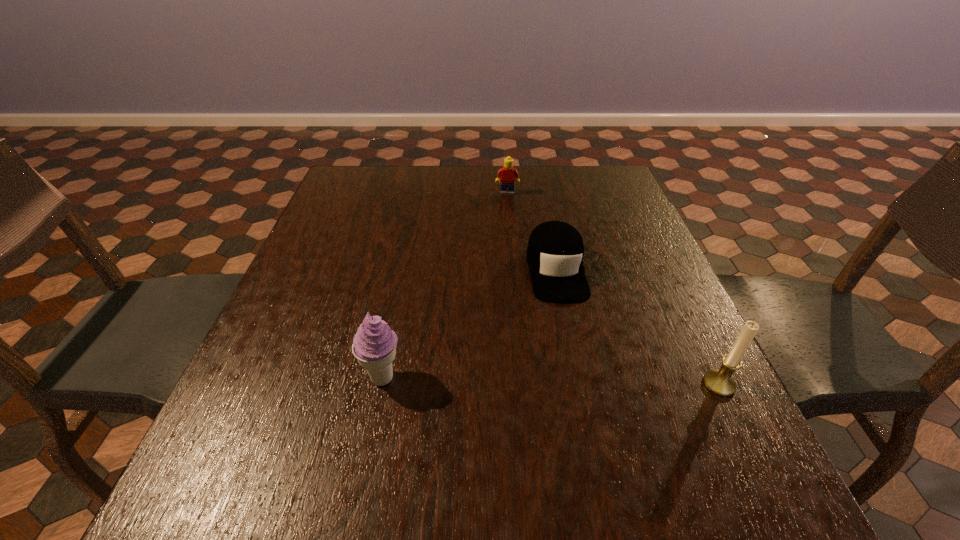
Find the location of a particular element. free space on the desktop that is between the icecream and the candle holder and is positioned on the front-facing side of the farthest object is located at coordinates (502, 380).

Image resolution: width=960 pixels, height=540 pixels. In order to click on vacant spot on the desktop that is between the icecream and the candle holder and is positioned on the front-facing side of the cap in this screenshot , I will do `click(581, 382)`.